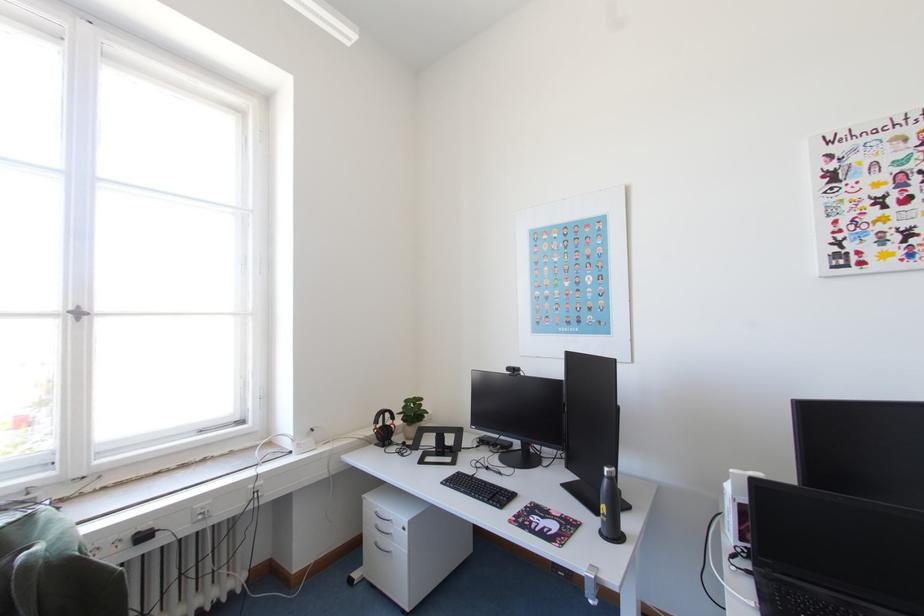
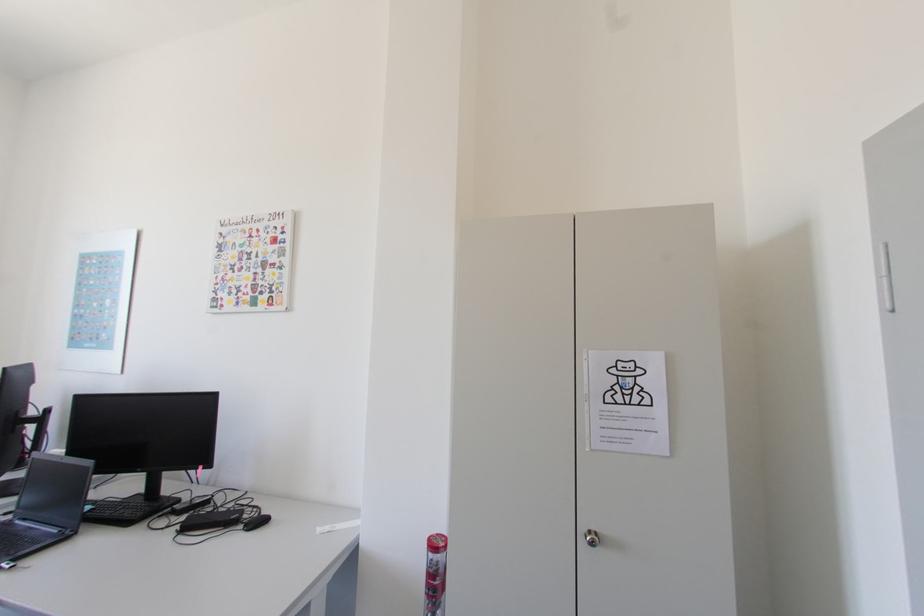
In a continuous first-person perspective shot, in which direction is the camera moving?

The movement direction of the cameraman is right, backward.